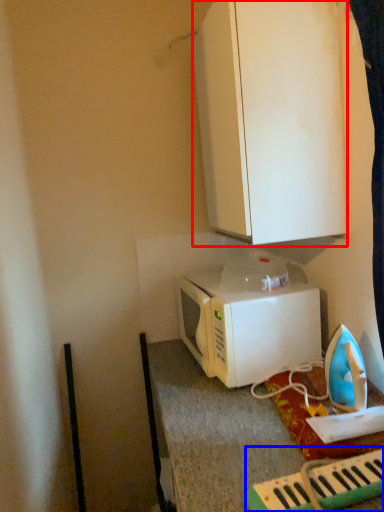
Question: Which object is closer to the camera taking this photo, cabinetry (highlighted by a red box) or musical keyboard (highlighted by a blue box)?

Choices:
 (A) cabinetry
 (B) musical keyboard

Answer: (B)